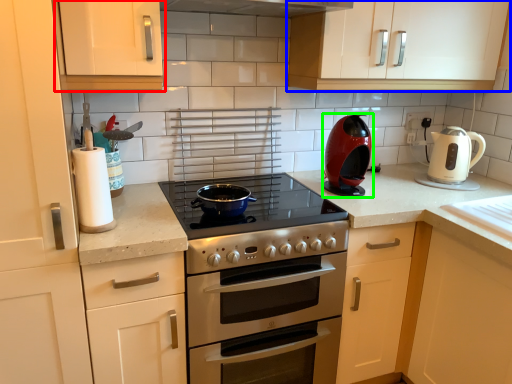
Question: Based on their relative distances, which object is nearer to cabinetry (highlighted by a red box)? Choose from cabinetry (highlighted by a blue box) and kitchen appliance (highlighted by a green box).

Choices:
 (A) cabinetry
 (B) kitchen appliance

Answer: (B)